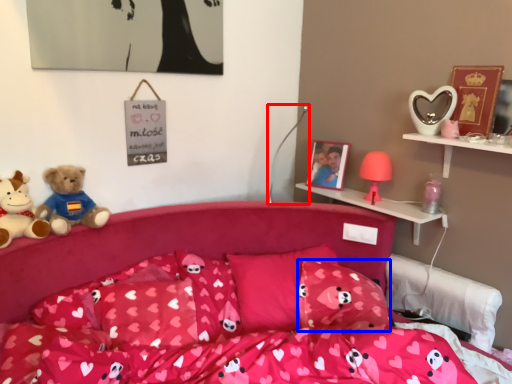
Question: Which object appears closest to the camera in this image, lamp (highlighted by a red box) or pillow (highlighted by a blue box)?

Choices:
 (A) lamp
 (B) pillow

Answer: (B)